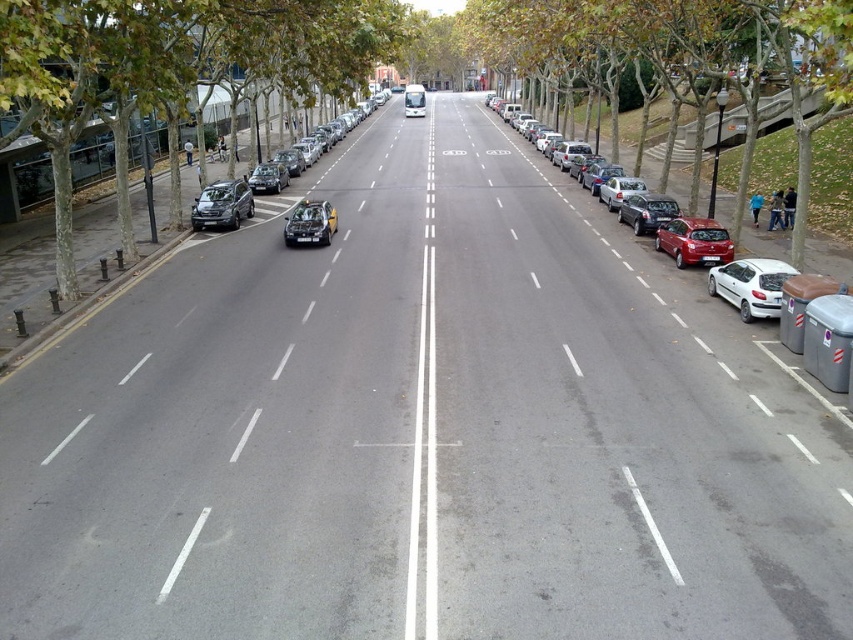
You are a pedestrian standing on the sidewalk on the left side of the street. You want to cross the street to the right side. There is a green leafy tree at left and a satin black car at center moving away from you. Which object is closer to you as you start crossing?

The green leafy tree at left is closer to you because it is positioned above the satin black car at center, meaning it is nearer in the vertical plane from your perspective.

You are a pedestrian standing at the edge of the street. You see a shiny silver car at center and a black plastic license plate at center. Which object takes up more space in the image?

The shiny silver car at center is larger in size than the black plastic license plate at center, so it takes up more space in the image.